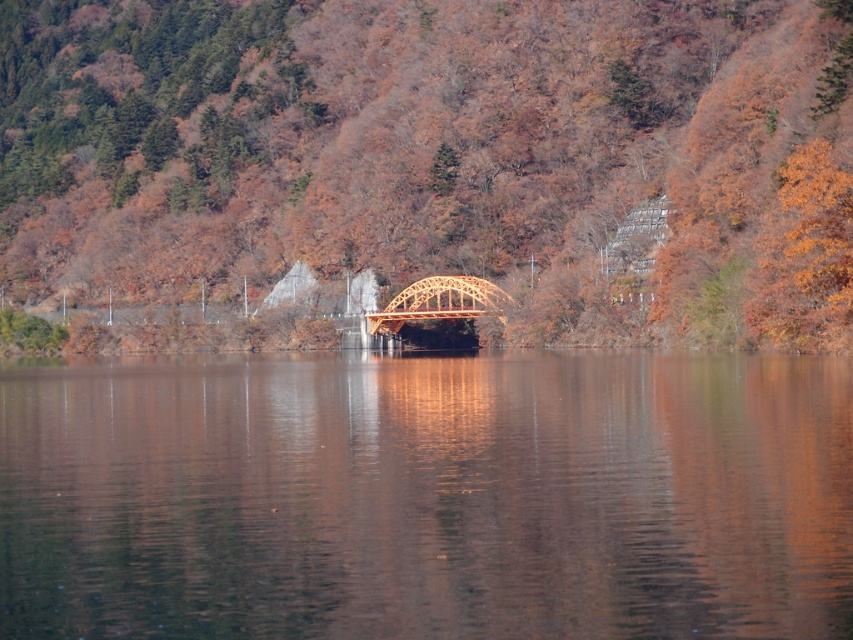
Does transparent water at center appear on the right side of wooden bridge at center?

No, transparent water at center is not to the right of wooden bridge at center.

Does transparent water at center have a smaller size compared to wooden bridge at center?

Actually, transparent water at center might be larger than wooden bridge at center.

Is point (730, 410) in front of point (448, 285)?

Yes.

This screenshot has height=640, width=853. Find the location of `transparent water at center`. transparent water at center is located at coordinates (428, 497).

What do you see at coordinates (437, 161) in the screenshot? I see `orange wood bridge at center` at bounding box center [437, 161].

This screenshot has width=853, height=640. I want to click on orange wood bridge at center, so click(437, 161).

Who is positioned more to the left, orange wood bridge at center or transparent water at center?

orange wood bridge at center is more to the left.

Which is behind, point (25, 74) or point (71, 378)?

The point (25, 74) is behind.

Where is `orange wood bridge at center`? The image size is (853, 640). orange wood bridge at center is located at coordinates (437, 161).